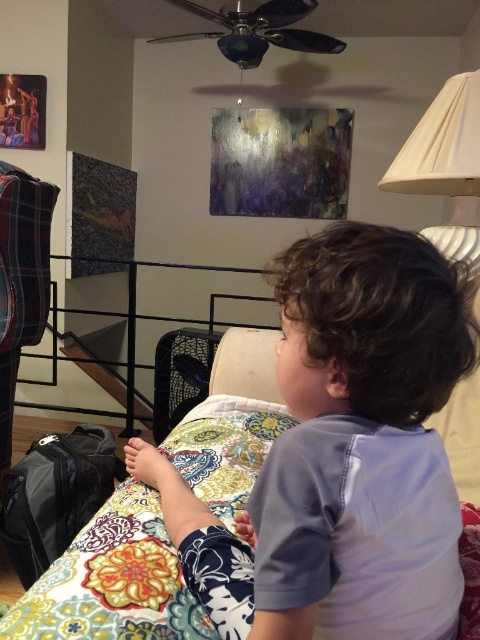
You are standing in the room and see the point at coordinates (55, 496). What object is this point located on?

The point at coordinates (55, 496) is located on the black fabric suitcase at lower left.

You are standing in the living room and see two points marked in the scene. The first point is at coordinates point (x=78, y=520) and the second is at point (x=478, y=77). Which point is closer to the staircase with black railings?

Point (x=78, y=520) is behind point (x=478, y=77), so the point closer to the staircase with black railings would be point (x=478, y=77).

Based on the photo, you are a photographer setting up a shoot in this room. You need to place a large equipment box that is 1 meter wide between the light blue cotton shirt at center and the white pleated lampshade at upper right. Based on their widths, will the box fit between them?

The light blue cotton shirt at center is wider than the white pleated lampshade at upper right. Since the equipment box is 1 meter wide, but the exact widths of the objects aren